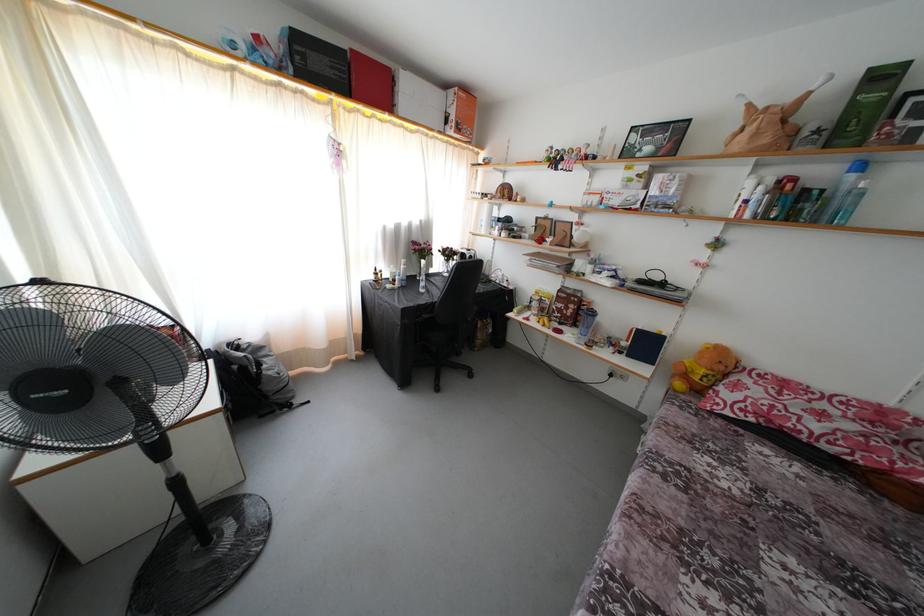
Which object does [844,188] point to?

It refers to a blue shaker bottle.